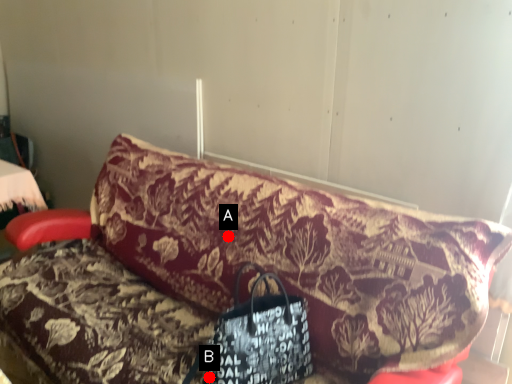
Question: Two points are circled on the image, labeled by A and B beside each circle. Among these points, which one is nearest to the camera?

Choices:
 (A) A is closer
 (B) B is closer

Answer: (B)